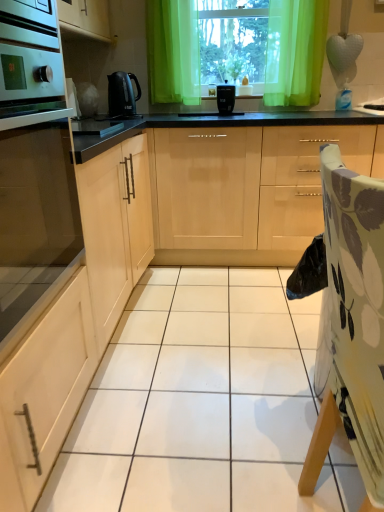
Question: From a real-world perspective, is floral fabric folding chair at right physically below matte wood cabinet at left, the 1th cabinetry from the left?

Choices:
 (A) no
 (B) yes

Answer: (A)

Question: From the image's perspective, is floral fabric folding chair at right above matte wood cabinet at left, the 1th cabinetry from the left?

Choices:
 (A) yes
 (B) no

Answer: (B)

Question: Is floral fabric folding chair at right looking in the opposite direction of matte wood cabinet at left, the 1th cabinetry from the left?

Choices:
 (A) no
 (B) yes

Answer: (A)

Question: Considering the relative sizes of floral fabric folding chair at right and matte wood cabinet at left, the 1th cabinetry from the left, in the image provided, is floral fabric folding chair at right wider than matte wood cabinet at left, the 1th cabinetry from the left,?

Choices:
 (A) yes
 (B) no

Answer: (B)

Question: Can you confirm if floral fabric folding chair at right is thinner than matte wood cabinet at left, the 1th cabinetry from the left?

Choices:
 (A) no
 (B) yes

Answer: (B)

Question: In the image, is green sheer curtain at upper center on the left side or the right side of black plastic toaster at center, which is counted as the second kitchen appliance, starting from the left?

Choices:
 (A) left
 (B) right

Answer: (B)

Question: Looking at their shapes, would you say green sheer curtain at upper center is wider or thinner than black plastic toaster at center, arranged as the 1th kitchen appliance when viewed from the right?

Choices:
 (A) thin
 (B) wide

Answer: (B)

Question: Considering the positions of green sheer curtain at upper center and black plastic toaster at center, which is counted as the second kitchen appliance, starting from the left, in the image, is green sheer curtain at upper center taller or shorter than black plastic toaster at center, which is counted as the second kitchen appliance, starting from the left,?

Choices:
 (A) short
 (B) tall

Answer: (B)

Question: From a real-world perspective, is green sheer curtain at upper center above or below black plastic toaster at center, which is counted as the second kitchen appliance, starting from the left?

Choices:
 (A) above
 (B) below

Answer: (A)

Question: Which is correct: light wood cabinet at center, which appears as the 3th cabinetry when viewed from the left, is inside green sheer curtains at upper center, or outside of it?

Choices:
 (A) inside
 (B) outside

Answer: (B)

Question: Considering the relative positions of light wood cabinet at center, the first cabinetry when ordered from right to left, and green sheer curtains at upper center in the image provided, is light wood cabinet at center, the first cabinetry when ordered from right to left, to the left or to the right of green sheer curtains at upper center?

Choices:
 (A) right
 (B) left

Answer: (A)

Question: Considering their positions, is light wood cabinet at center, the first cabinetry when ordered from right to left, located in front of or behind green sheer curtains at upper center?

Choices:
 (A) behind
 (B) front

Answer: (B)

Question: Considering the positions of light wood cabinet at center, which appears as the 3th cabinetry when viewed from the left, and green sheer curtains at upper center in the image, is light wood cabinet at center, which appears as the 3th cabinetry when viewed from the left, taller or shorter than green sheer curtains at upper center?

Choices:
 (A) short
 (B) tall

Answer: (B)

Question: From the image's perspective, relative to floral fabric folding chair at right, is green sheer curtain at upper center above or below?

Choices:
 (A) below
 (B) above

Answer: (B)

Question: Is green sheer curtain at upper center spatially inside floral fabric folding chair at right, or outside of it?

Choices:
 (A) outside
 (B) inside

Answer: (A)